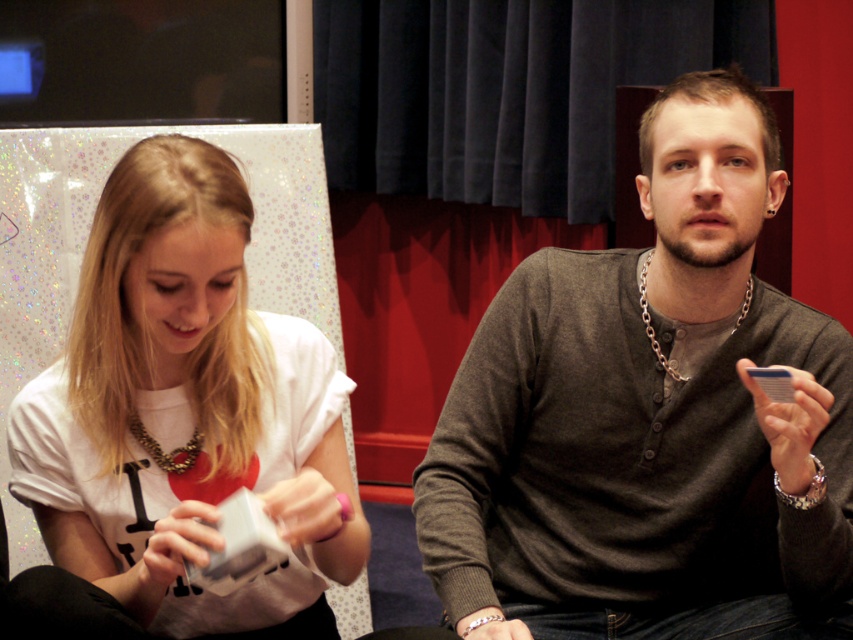
Question: Is matte gray sweater at center positioned in front of gold chain necklace at center?

Choices:
 (A) no
 (B) yes

Answer: (B)

Question: Can you confirm if matte gray sweater at center is bigger than gold textured necklace at center?

Choices:
 (A) yes
 (B) no

Answer: (A)

Question: Which object is farther from the camera taking this photo?

Choices:
 (A) matte gray sweater at center
 (B) white matte t-shirt at center
 (C) gold textured necklace at center

Answer: (C)

Question: Which point is closer to the camera taking this photo?

Choices:
 (A) (741, 304)
 (B) (158, 294)

Answer: (B)

Question: Which point is farther to the camera?

Choices:
 (A) gold chain necklace at center
 (B) gold textured necklace at center
 (C) white matte t-shirt at center

Answer: (A)

Question: Can you confirm if matte gray sweater at center is wider than gold textured necklace at center?

Choices:
 (A) no
 (B) yes

Answer: (B)